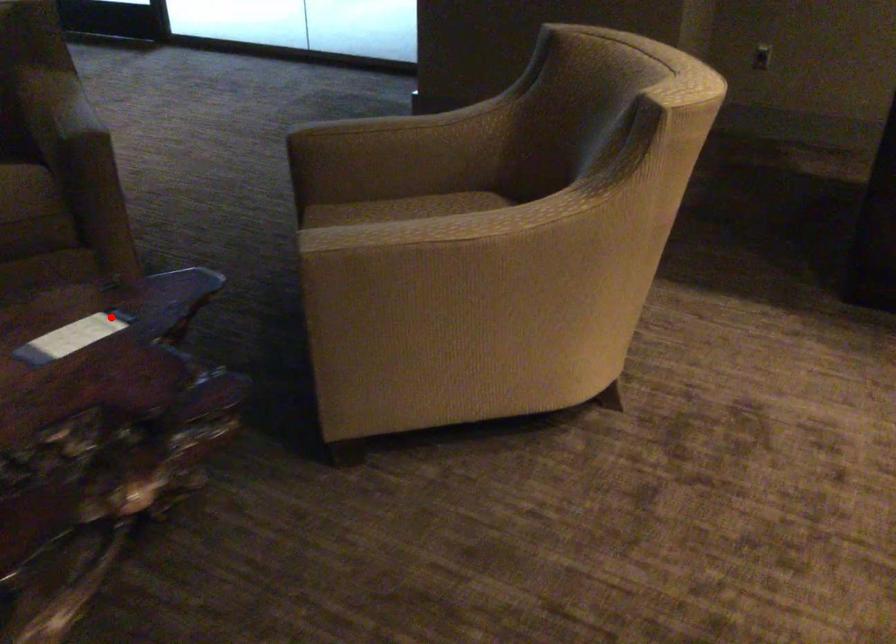
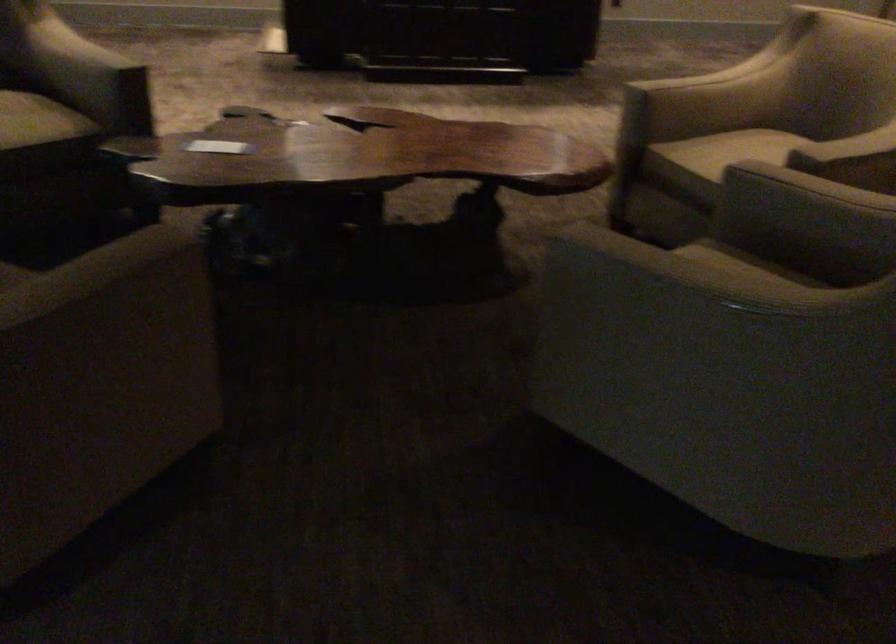
Question: I am providing you with two images of the same scene from different viewpoints. Image1 has a red point marked. In image2, the corresponding 3D location appears at what relative position? Reply with the corresponding letter.

Choices:
 (A) Closer
 (B) Farther

Answer: (B)